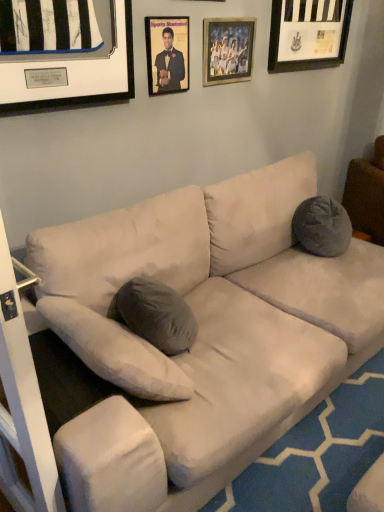
Question: In terms of size, does matte black frame at upper center, which ranks as the 1th picture frame in left-to-right order, appear bigger or smaller than wooden picture frame at upper center, which appears as the second picture frame when viewed from the right?

Choices:
 (A) small
 (B) big

Answer: (A)

Question: Looking at their shapes, would you say matte black frame at upper center, which is the 3th picture frame in right-to-left order, is wider or thinner than wooden picture frame at upper center, the second picture frame positioned from the left?

Choices:
 (A) thin
 (B) wide

Answer: (B)

Question: Which is nearer to the wooden picture frame at upper center, the second picture frame positioned from the left?

Choices:
 (A) gray fabric pillow at right
 (B) black matte picture frame at upper right, which ranks as the 1th picture frame in right-to-left order
 (C) matte black frame at upper center, which ranks as the 1th picture frame in left-to-right order

Answer: (C)

Question: Which is farther from the gray fabric pillow at right?

Choices:
 (A) wooden picture frame at upper center, which appears as the second picture frame when viewed from the right
 (B) black matte picture frame at upper right, which ranks as the 1th picture frame in right-to-left order
 (C) matte black frame at upper center, which ranks as the 1th picture frame in left-to-right order

Answer: (C)